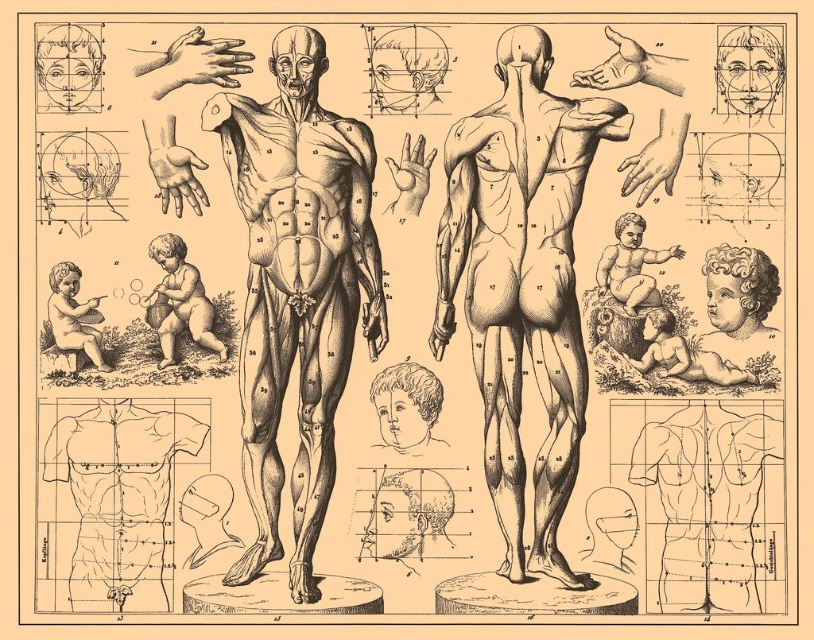
Is point (528, 564) closer to viewer compared to point (184, 307)?

Yes, it is.

At what (x,y) coordinates should I click in order to perform the action: click on black ink drawing of human body at center. Please return your answer as a coordinate pair (x, y). This screenshot has width=814, height=640. Looking at the image, I should click on (523, 282).

Who is more forward, (558, 355) or (189, 273)?

Positioned in front is point (558, 355).

The height and width of the screenshot is (640, 814). What are the coordinates of `black ink drawing of human body at center` in the screenshot? It's located at (523, 282).

Consider the image. Is smooth beige baby at lower left bigger than smooth beige cherub at bottom left?

No.

Who is shorter, smooth beige baby at lower left or smooth beige cherub at bottom left?

With less height is smooth beige baby at lower left.

Who is more distant from viewer, (171, 289) or (90, 320)?

Positioned behind is point (90, 320).

Identify the location of smooth beige baby at lower left. (178, 300).

Between black ink anatomical figure at center and smooth beige baby at lower right, which one has more height?

With more height is black ink anatomical figure at center.

The width and height of the screenshot is (814, 640). I want to click on black ink anatomical figure at center, so click(x=296, y=288).